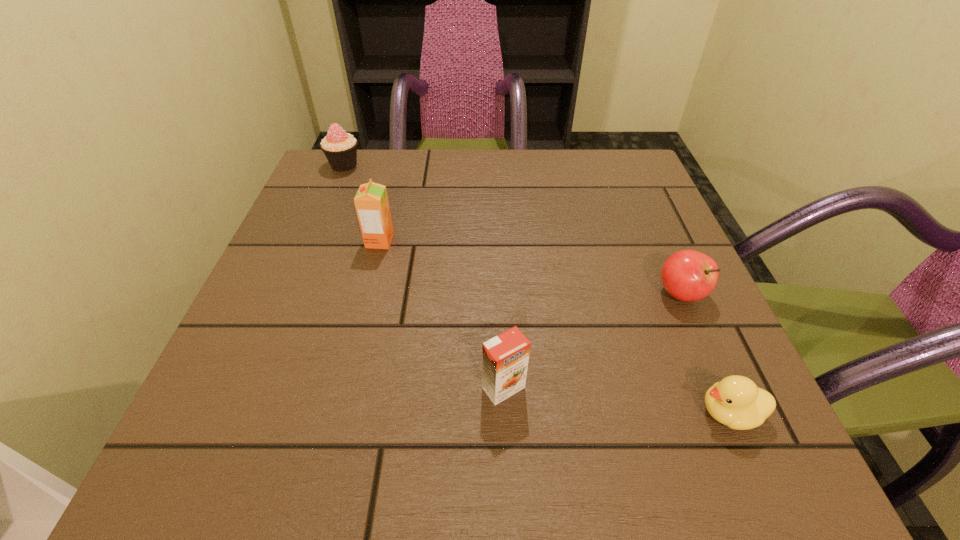
I want to click on vacant area between the duckling and the shorter orange juice, so (x=616, y=400).

Where is `empty location between the apple and the duckling`? empty location between the apple and the duckling is located at coordinates (706, 353).

Where is `free point between the duckling and the leftmost object`? The height and width of the screenshot is (540, 960). free point between the duckling and the leftmost object is located at coordinates (537, 289).

The width and height of the screenshot is (960, 540). In order to click on free space between the duckling and the third nearest object in this screenshot , I will do `click(706, 353)`.

Find the location of `free space between the farther orange juice and the apple`. free space between the farther orange juice and the apple is located at coordinates (530, 267).

You are a GUI agent. You are given a task and a screenshot of the screen. Output one action in this format:
    pyautogui.click(x=<x>, y=<y>)
    Task: Click on the unoccupied area between the farthest object and the duckling
    The height and width of the screenshot is (540, 960).
    Given the screenshot: What is the action you would take?
    pyautogui.click(x=537, y=289)

Where is `unoccupied position between the shorter orange juice and the leftmost object`? This screenshot has height=540, width=960. unoccupied position between the shorter orange juice and the leftmost object is located at coordinates (423, 276).

Image resolution: width=960 pixels, height=540 pixels. I want to click on object that can be found as the second closest to the tallest object, so click(505, 357).

This screenshot has width=960, height=540. Find the location of `object that can be found as the fourth closest to the third nearest object`. object that can be found as the fourth closest to the third nearest object is located at coordinates (340, 148).

In order to click on free location that satisfies the following two spatial constraints: 1. on the front side of the second farthest object; 2. on the left side of the shorter orange juice in this screenshot , I will do `click(344, 388)`.